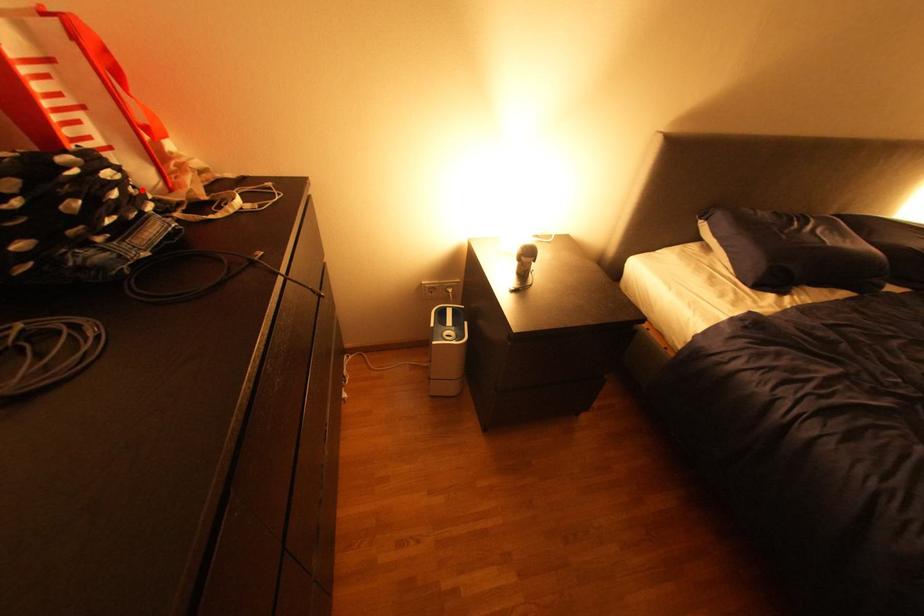
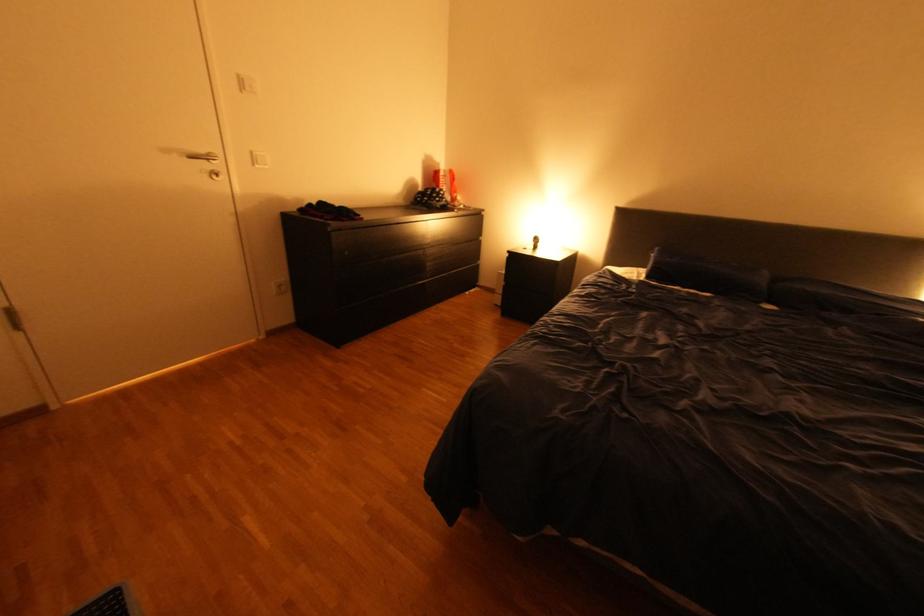
Question: I am providing you with two images of the same scene from different viewpoints. A red point is shown in image1. For the corresponding object point in image2, is it positioned nearer or farther from the camera?

Choices:
 (A) Nearer
 (B) Farther

Answer: (A)